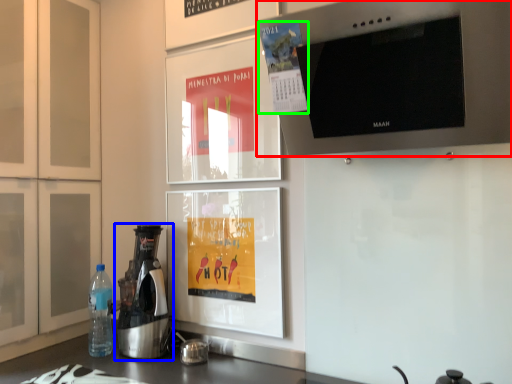
Question: Which object is the closest to the home appliance (highlighted by a red box)? Choose among these: kitchen appliance (highlighted by a blue box) or poster (highlighted by a green box).

Choices:
 (A) kitchen appliance
 (B) poster

Answer: (B)